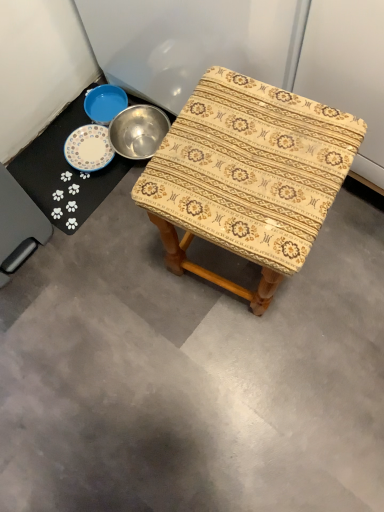
Where is `free space above patterned fabric stool at center (from a real-world perspective)`? The image size is (384, 512). free space above patterned fabric stool at center (from a real-world perspective) is located at coordinates (247, 158).